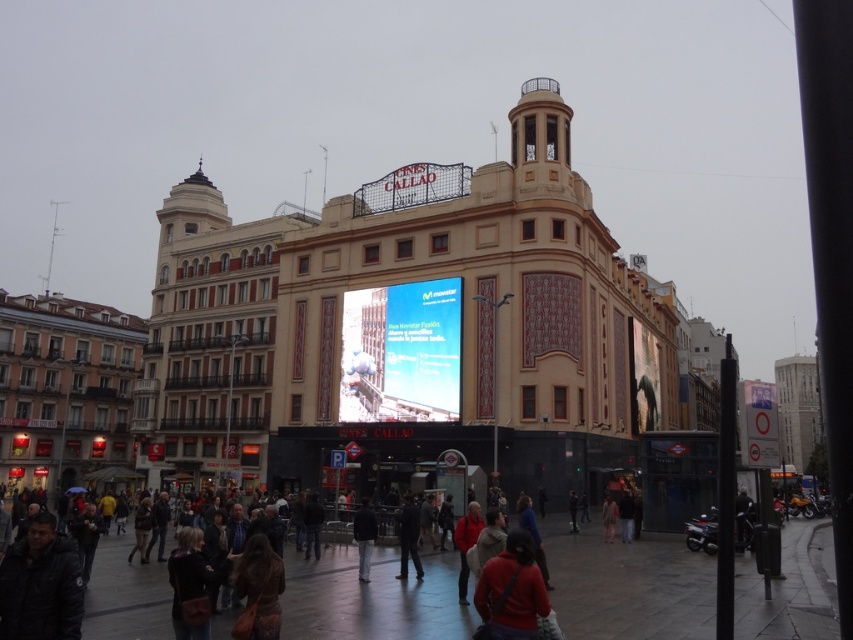
Between blue glossy screen at center and red jacket at center, which one appears on the right side from the viewer's perspective?

red jacket at center is more to the right.

Can you confirm if blue glossy screen at center is positioned to the left of red jacket at center?

Indeed, blue glossy screen at center is positioned on the left side of red jacket at center.

Who is more forward, (430,310) or (477,531)?

Point (477,531) is in front.

Locate an element on the screen. blue glossy screen at center is located at coordinates (424, 342).

Is point (473, 545) farther from viewer compared to point (364, 564)?

No, it is not.

Between point (480, 516) and point (373, 515), which one is positioned in front?

Point (373, 515) is in front.

Locate an element on the screen. red jacket at center is located at coordinates (466, 544).

Based on the photo, does dark blue jacket at center have a smaller size compared to brown leather jacket at center?

No, dark blue jacket at center is not smaller than brown leather jacket at center.

I want to click on dark blue jacket at center, so click(x=408, y=536).

Locate an element on the screen. dark blue jacket at center is located at coordinates (408, 536).